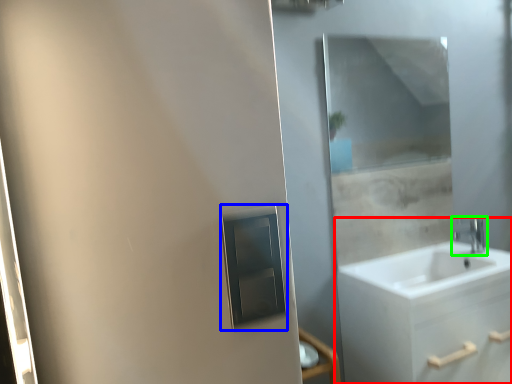
Question: Considering the real-world distances, which object is closest to bathroom cabinet (highlighted by a red box)? medicine cabinet (highlighted by a blue box) or tap (highlighted by a green box).

Choices:
 (A) medicine cabinet
 (B) tap

Answer: (B)